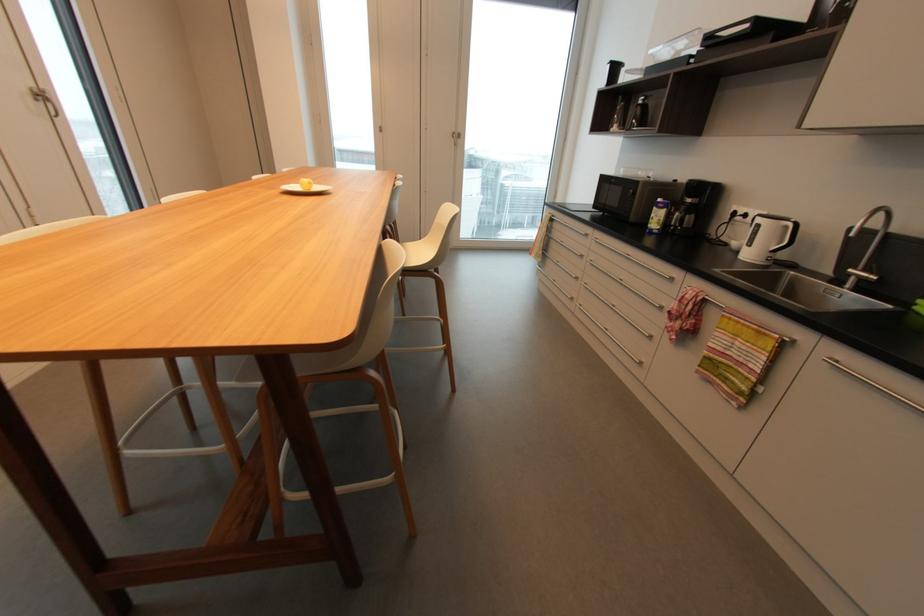
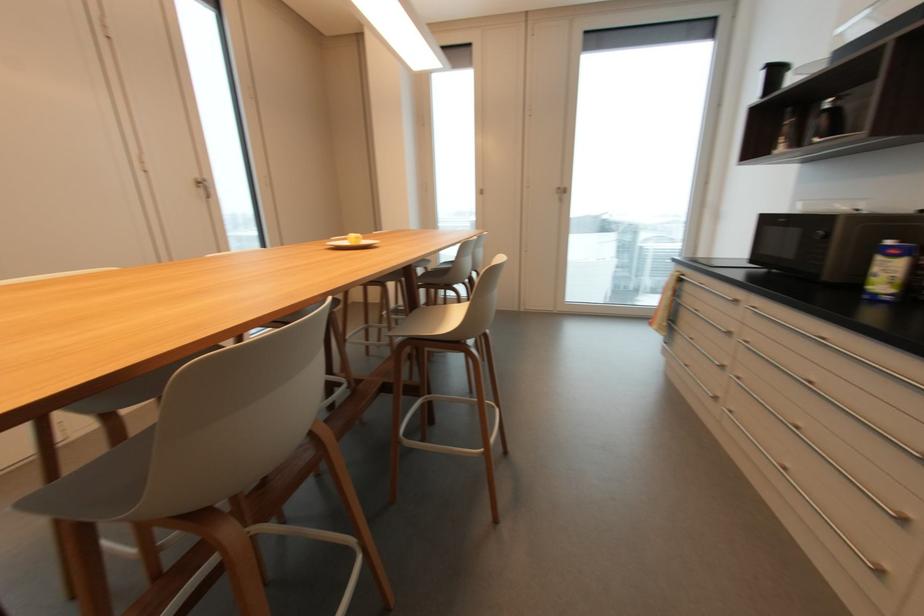
Consider the image. In a continuous first-person perspective shot, in which direction is the camera moving?

The cameraman moved toward right, forward.